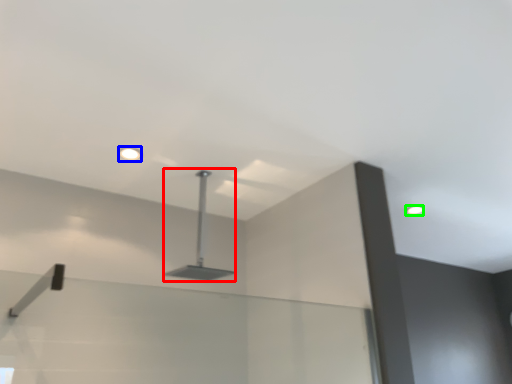
Question: Which object is positioned closest to lamp (highlighted by a red box)? Select from droplight (highlighted by a blue box) and droplight (highlighted by a green box).

Choices:
 (A) droplight
 (B) droplight

Answer: (A)